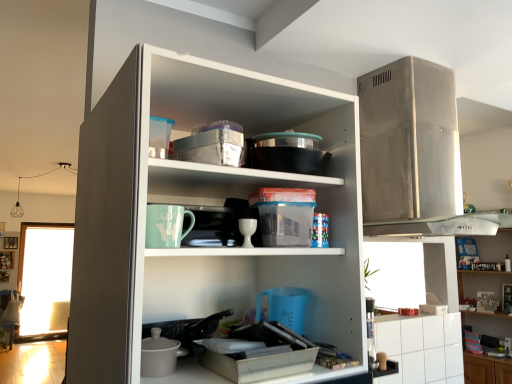
Question: Would you say stainless steel range hood at upper right, the second appliance positioned from the left, is inside or outside white glossy cup at center?

Choices:
 (A) inside
 (B) outside

Answer: (B)

Question: In terms of height, does stainless steel range hood at upper right, which is the first appliance in top-to-bottom order, look taller or shorter compared to white glossy cup at center?

Choices:
 (A) short
 (B) tall

Answer: (B)

Question: Based on their relative distances, which object is nearer to the transparent glass window at left?

Choices:
 (A) stainless steel range hood at upper right, acting as the second appliance starting from the bottom
 (B) matte ceramic mug at center, the first appliance when ordered from front to back
 (C) white glossy cup at center
 (D) white matte cupboard at center
 (E) white glossy cabinet at lower right

Answer: (E)

Question: Estimate the real-world distances between objects in this image. Which object is closer to the white glossy cabinet at upper right?

Choices:
 (A) white glossy cabinet at lower right
 (B) white glossy cup at center
 (C) transparent glass window at left
 (D) stainless steel range hood at upper right, acting as the second appliance starting from the bottom
 (E) matte ceramic mug at center, the first appliance when ordered from front to back

Answer: (A)